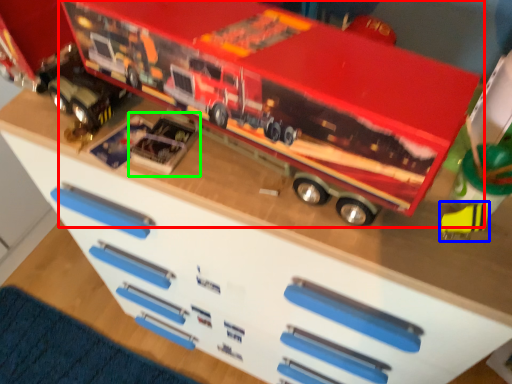
Question: Which object is positioned farthest from toy (highlighted by a red box)? Select from toy (highlighted by a blue box) and toy (highlighted by a green box).

Choices:
 (A) toy
 (B) toy

Answer: (A)